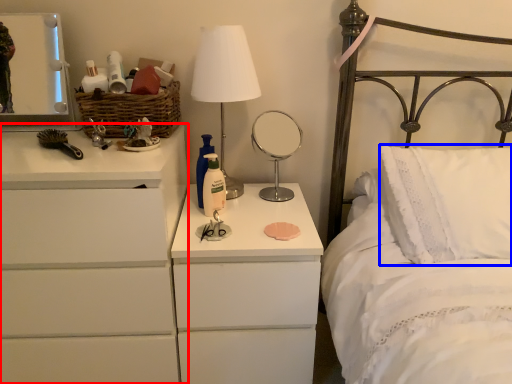
Question: Which object is closer to the camera taking this photo, chest of drawers (highlighted by a red box) or pillow (highlighted by a blue box)?

Choices:
 (A) chest of drawers
 (B) pillow

Answer: (A)